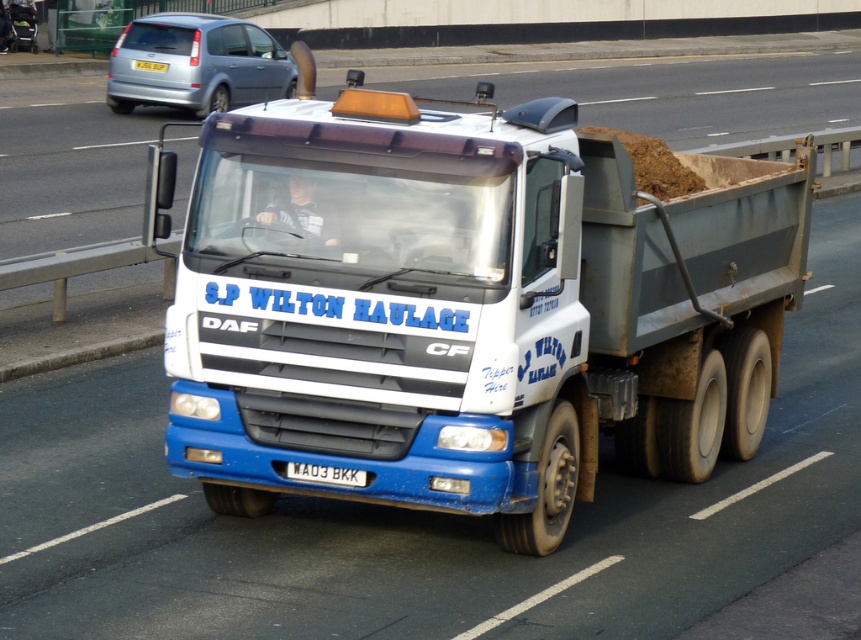
Between point (194, 72) and point (329, 476), which one is positioned in front?

Positioned in front is point (329, 476).

Between metallic silver van at upper left and white metallic license plate at center, which one is positioned lower?

Positioned lower is white metallic license plate at center.

Does point (279, 81) come closer to viewer compared to point (339, 468)?

No.

Locate an element on the screen. This screenshot has width=861, height=640. metallic silver van at upper left is located at coordinates (196, 64).

Is blue matte truck at center positioned before white plastic license plate at center?

That is True.

Between blue matte truck at center and white plastic license plate at center, which one appears on the right side from the viewer's perspective?

From the viewer's perspective, blue matte truck at center appears more on the right side.

Between point (592, 388) and point (160, 72), which one is positioned in front?

Point (592, 388)

You are a GUI agent. You are given a task and a screenshot of the screen. Output one action in this format:
    pyautogui.click(x=<x>, y=<y>)
    Task: Click on the blue matte truck at center
    This screenshot has height=640, width=861.
    Given the screenshot: What is the action you would take?
    pyautogui.click(x=469, y=308)

Is blue matte truck at center taller than metallic silver van at upper left?

No.

Where is `blue matte truck at center`? This screenshot has height=640, width=861. blue matte truck at center is located at coordinates (469, 308).

Who is more distant from viewer, (754, 396) or (146, 83)?

The point (146, 83) is behind.

The width and height of the screenshot is (861, 640). I want to click on blue matte truck at center, so click(x=469, y=308).